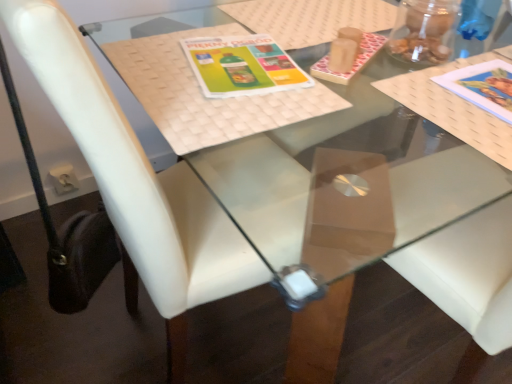
Identify the location of vacant area on top of matte green plastic book cover at center, the first book cover viewed from the left (from a real-world perspective). This screenshot has width=512, height=384. (233, 60).